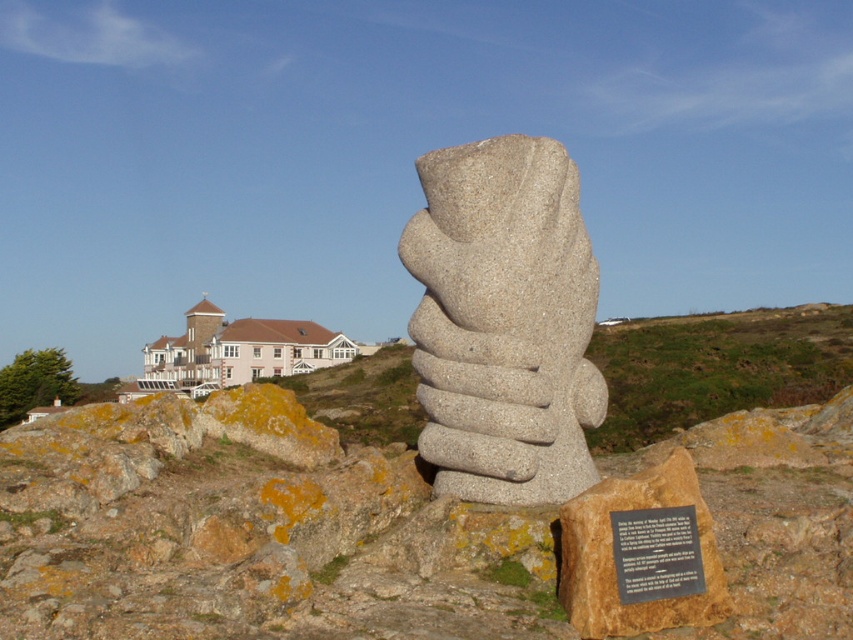
Based on the photo, you are an artist who wants to place a new sculpture between the brown rock at center and the black paper at center. Which object should you move to make space?

The brown rock at center is larger in size than black paper at center, so you should move the brown rock at center to make space for the new sculpture.